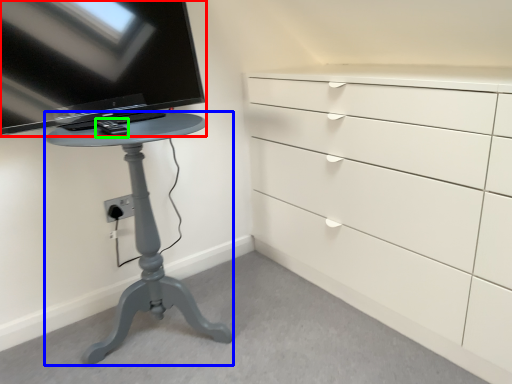
Question: Based on their relative distances, which object is nearer to television (highlighted by a red box)? Choose from furniture (highlighted by a blue box) and equipment (highlighted by a green box).

Choices:
 (A) furniture
 (B) equipment

Answer: (B)